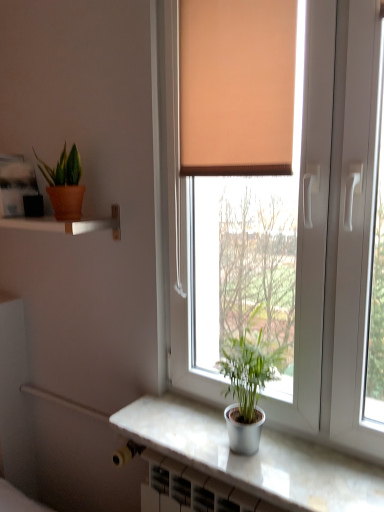
What are the coordinates of `vacant space behind silver metallic pot at window, the 2th houseplant when ordered from back to front` in the screenshot? It's located at (213, 424).